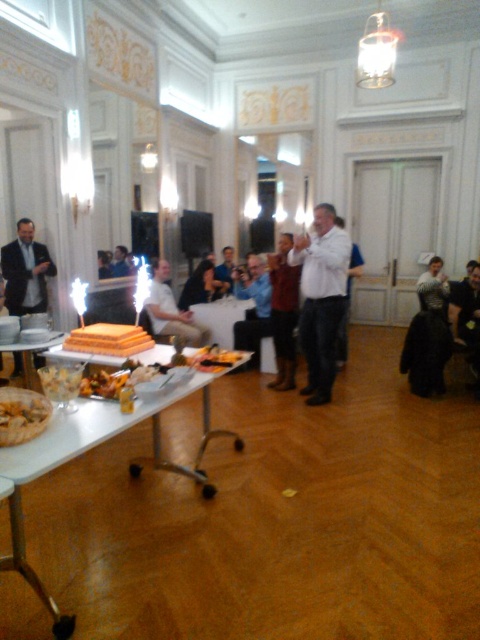
The image size is (480, 640). Find the location of `matte black suit at left`. matte black suit at left is located at coordinates (25, 272).

Does leather jacket at center have a smaller size compared to yellow sponge cake at center?

Actually, leather jacket at center might be larger than yellow sponge cake at center.

Which is more to the right, leather jacket at center or yellow sponge cake at center?

leather jacket at center is more to the right.

The image size is (480, 640). What are the coordinates of `leather jacket at center` in the screenshot? It's located at (284, 312).

Locate an element on the screen. The width and height of the screenshot is (480, 640). leather jacket at center is located at coordinates (284, 312).

At what (x,y) coordinates should I click in order to perform the action: click on white plastic table at lower left. Please return your answer as a coordinate pair (x, y). Image resolution: width=480 pixels, height=640 pixels. Looking at the image, I should click on [91, 449].

Is point (203, 400) positioned behind point (254, 256)?

That is False.

I want to click on white plastic table at lower left, so click(91, 449).